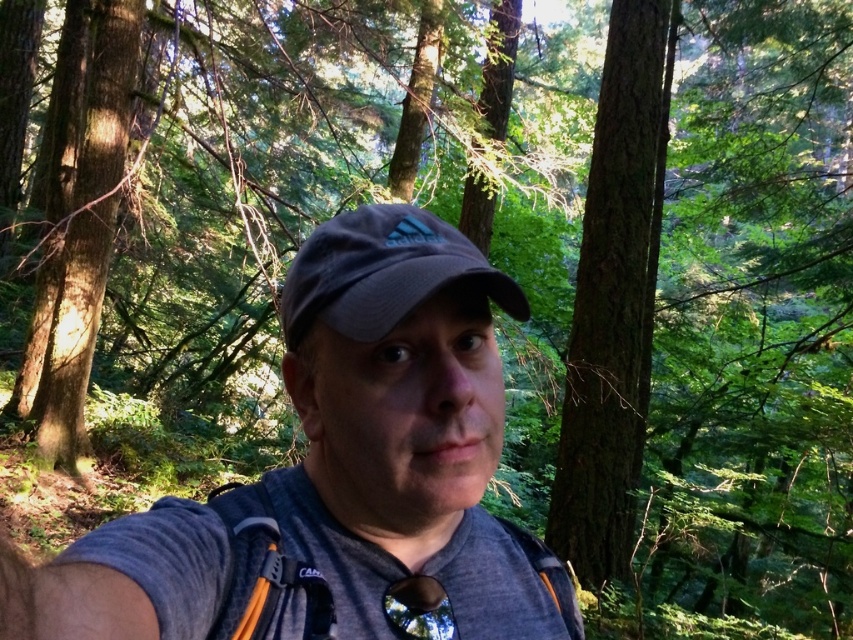
Consider the image. You are a photographer trying to capture the person in the forest. The person is wearing a gray Adidas cap at center. You want to place a focus point at point (339, 476). Will this point be on the gray fabric cap at center?

Yes, the point (339, 476) is on the gray fabric cap at center, so placing the focus point there will ensure the cap is in focus.

You are a photographer planning to capture a wide shot of the smooth bark tree at center and the dark gray fabric cap at center. Given the spatial relationship between them, which object will appear larger in the photo?

The smooth bark tree at center will appear larger in the photo because its width surpasses that of the dark gray fabric cap at center.